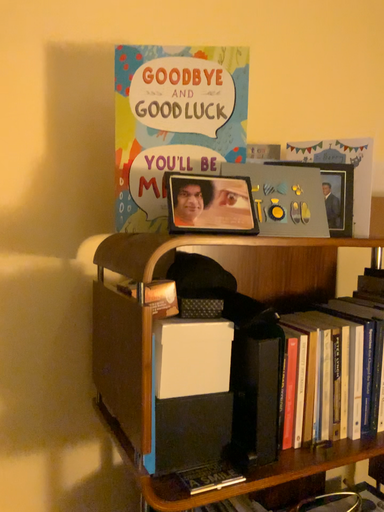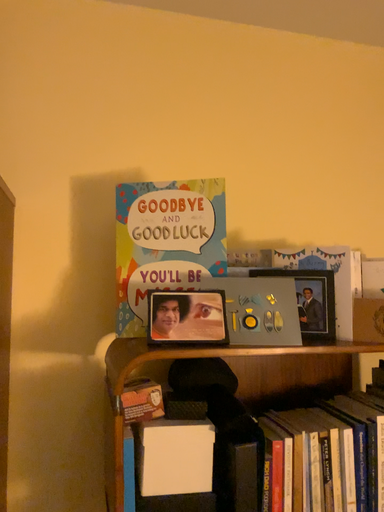
Question: Which way did the camera rotate in the video?

Choices:
 (A) rotated upward
 (B) rotated downward

Answer: (A)